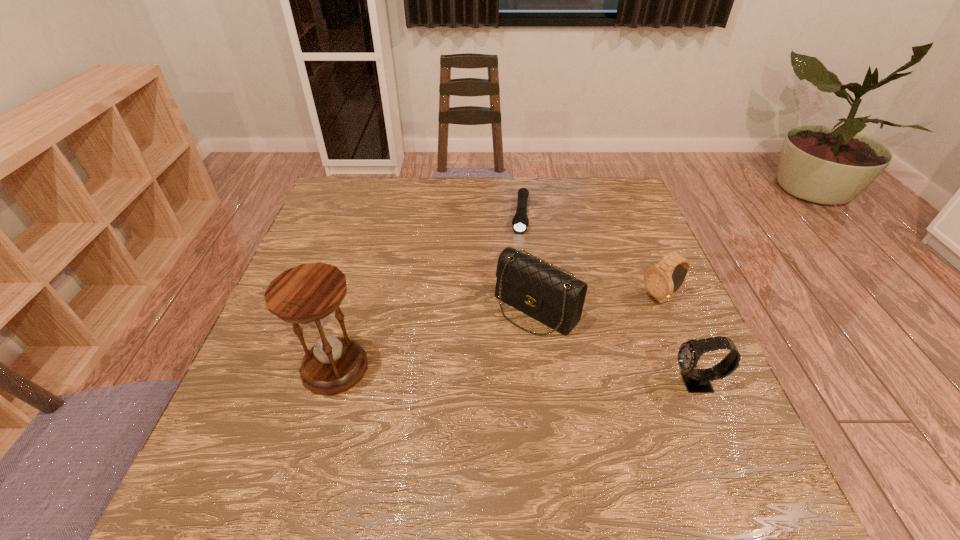
Where is `free space on the desktop that is between the hourglass and the nearer watch and is positioned at the lens end of the farthest object`? free space on the desktop that is between the hourglass and the nearer watch and is positioned at the lens end of the farthest object is located at coordinates (504, 375).

Identify the location of vacant space on the desktop that is between the hourglass and the nearer watch and is positioned on the face of the farther watch. Image resolution: width=960 pixels, height=540 pixels. (511, 375).

Identify the location of vacant space on the desktop that is between the leftmost object and the nearer watch and is positioned on the front flap of the clutch bag. This screenshot has width=960, height=540. (475, 373).